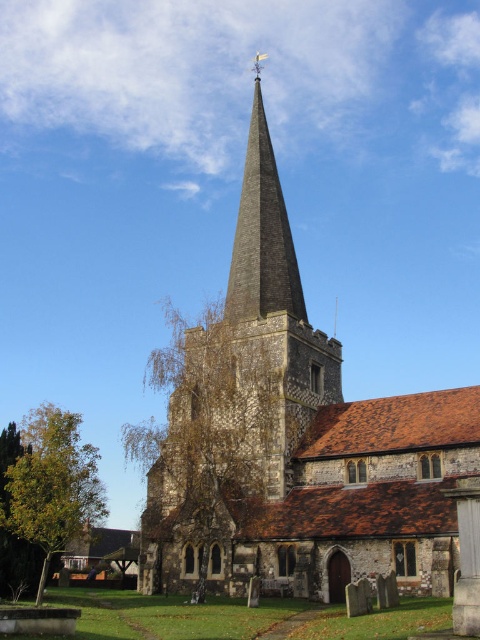
Can you confirm if stone steeple at center is smaller than dark gray stone spire at center?

Incorrect, stone steeple at center is not smaller in size than dark gray stone spire at center.

Based on the photo, which is above, stone steeple at center or dark gray stone spire at center?

dark gray stone spire at center

Between point (257, 572) and point (276, 266), which one is positioned in front?

Point (257, 572)

At what (x,y) coordinates should I click in order to perform the action: click on stone steeple at center. Please return your answer as a coordinate pair (x, y). The width and height of the screenshot is (480, 640). Looking at the image, I should click on (294, 442).